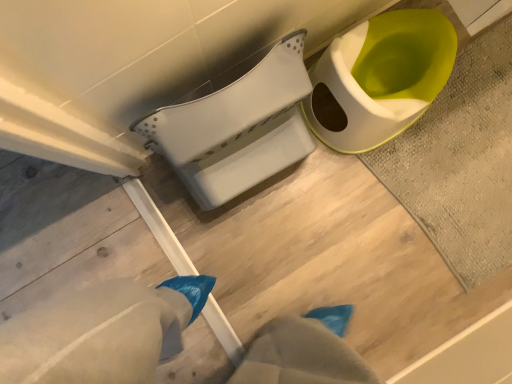
You are a GUI agent. You are given a task and a screenshot of the screen. Output one action in this format:
    pyautogui.click(x=<x>, y=<y>)
    Task: Click on the space that is in front of textured gray bath mat at upper right
    Image resolution: width=512 pixels, height=384 pixels.
    Given the screenshot: What is the action you would take?
    pyautogui.click(x=400, y=297)